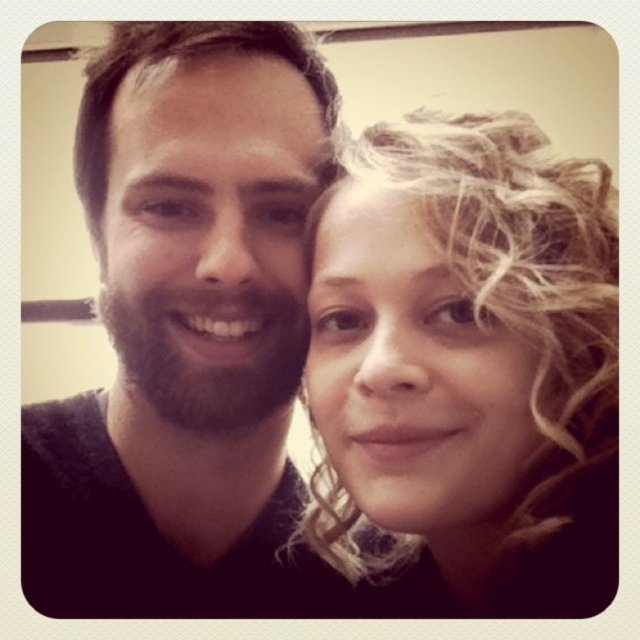
Does dark brown hair at left have a lesser height compared to dark brown curly hair at upper left?

In fact, dark brown hair at left may be taller than dark brown curly hair at upper left.

Is dark brown hair at left taller than dark brown curly hair at upper left?

Yes.

Is point (45, 522) less distant than point (122, 60)?

No.

The height and width of the screenshot is (640, 640). Identify the location of dark brown hair at left. (186, 330).

Can you confirm if blonde curly hair at right is positioned to the left of dark brown curly hair at upper left?

No, blonde curly hair at right is not to the left of dark brown curly hair at upper left.

From the picture: Which is more to the right, blonde curly hair at right or dark brown curly hair at upper left?

blonde curly hair at right is more to the right.

In the scene shown: Who is more distant from viewer, (518, 449) or (282, 56)?

Positioned behind is point (282, 56).

Find the location of a particular element. This screenshot has width=640, height=640. blonde curly hair at right is located at coordinates (467, 369).

Who is lower down, dark brown hair at left or blonde curly hair at right?

Positioned lower is blonde curly hair at right.

Does dark brown hair at left have a lesser height compared to blonde curly hair at right?

No.

Does point (131, 280) come farther from viewer compared to point (320, 372)?

That is True.

This screenshot has height=640, width=640. Find the location of `dark brown hair at left`. dark brown hair at left is located at coordinates [x=186, y=330].